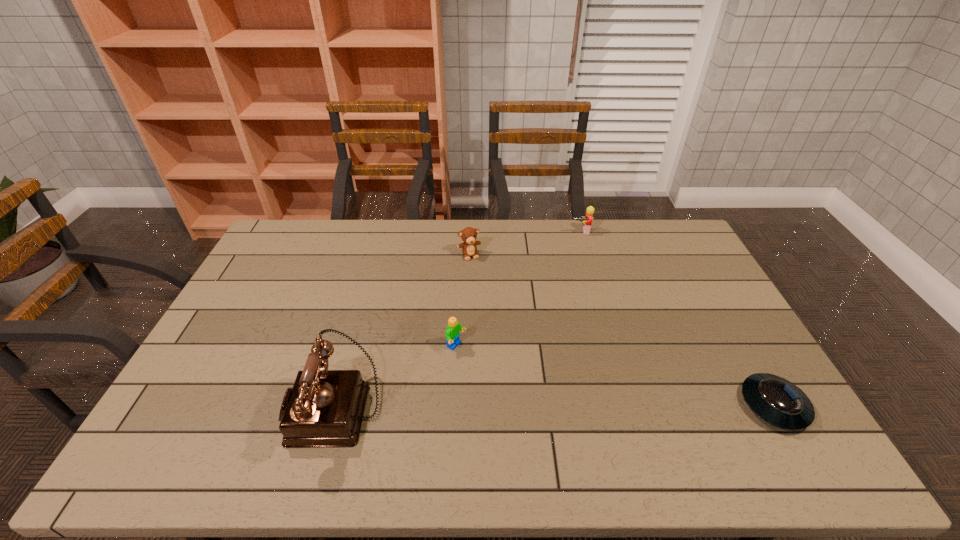
Where is `free space between the leftmost object and the left Lego`? The width and height of the screenshot is (960, 540). free space between the leftmost object and the left Lego is located at coordinates (396, 377).

This screenshot has height=540, width=960. I want to click on vacant space that's between the teddy bear and the nearer Lego, so pos(463,301).

Where is `empty space that is in between the left Lego and the farthest object`? The image size is (960, 540). empty space that is in between the left Lego and the farthest object is located at coordinates (518, 289).

Identify the location of vacant area between the farther Lego and the second farthest object. Image resolution: width=960 pixels, height=540 pixels. (525, 243).

At what (x,y) coordinates should I click in order to perform the action: click on free space between the leftmost object and the left Lego. Please return your answer as a coordinate pair (x, y). The height and width of the screenshot is (540, 960). Looking at the image, I should click on (396, 377).

You are a GUI agent. You are given a task and a screenshot of the screen. Output one action in this format:
    pyautogui.click(x=<x>, y=<y>)
    Task: Click on the fourth closest object to the leftmost object
    
    Given the screenshot: What is the action you would take?
    pyautogui.click(x=779, y=402)

Image resolution: width=960 pixels, height=540 pixels. Identify the location of object that is the second closest to the teddy bear. pos(452,334).

The width and height of the screenshot is (960, 540). Identify the location of vacant position in the image that satisfies the following two spatial constraints: 1. on the front side of the nearer Lego; 2. on the right side of the saucer. pyautogui.click(x=453, y=406).

Identify the location of vacant region that satisfies the following two spatial constraints: 1. on the front side of the rightmost object; 2. on the left side of the left Lego. (453, 406).